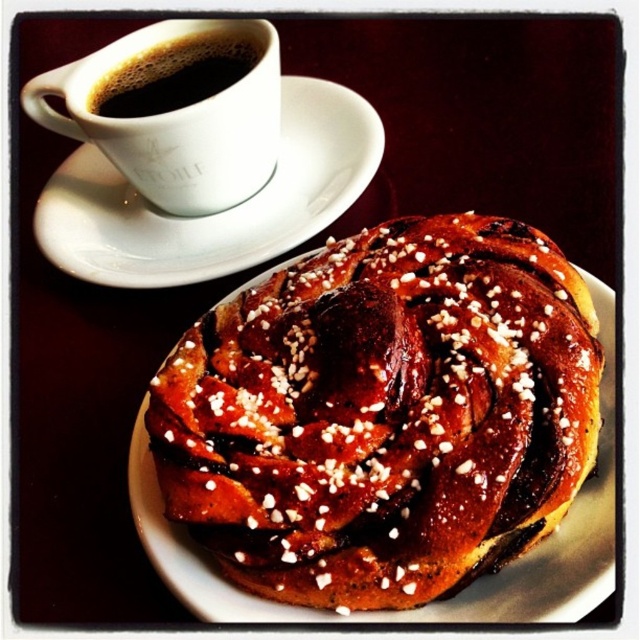
Question: Which object appears farthest from the camera in this image?

Choices:
 (A) golden-brown glazed pastry at center
 (B) white ceramic saucer at upper left

Answer: (B)

Question: Which of these objects is positioned farthest from the golden-brown glazed pastry at center?

Choices:
 (A) black glossy cup at upper left
 (B) white ceramic saucer at upper left

Answer: (A)

Question: Does golden-brown glazed pastry at center come behind white ceramic saucer at upper left?

Choices:
 (A) no
 (B) yes

Answer: (A)

Question: Which point appears farthest from the camera in this image?

Choices:
 (A) (83, 58)
 (B) (376, 144)
 (C) (593, 320)
 (D) (224, 48)

Answer: (A)

Question: Is white ceramic saucer at upper left behind black glossy cup at upper left?

Choices:
 (A) no
 (B) yes

Answer: (A)

Question: Can you confirm if white ceramic saucer at upper left is wider than black glossy cup at upper left?

Choices:
 (A) no
 (B) yes

Answer: (B)